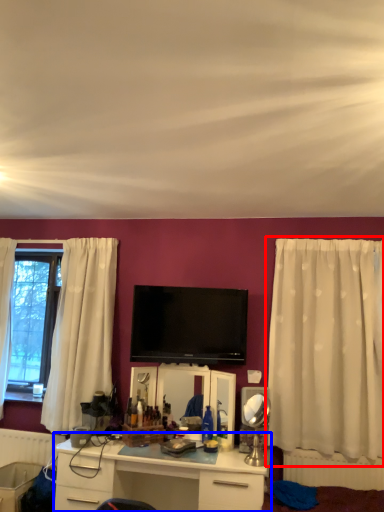
Question: Which point is closer to the camera, curtain (highlighted by a red box) or desk (highlighted by a blue box)?

Choices:
 (A) curtain
 (B) desk

Answer: (B)